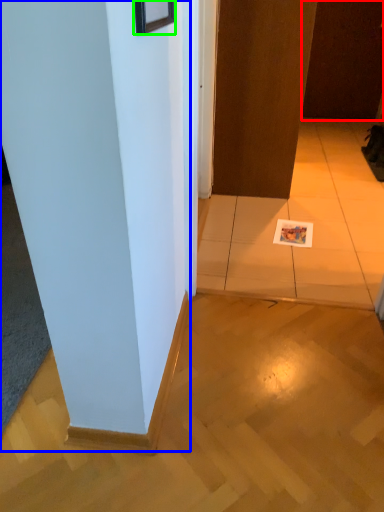
Question: Which is nearer to the door (highlighted by a red box)? pillar (highlighted by a blue box) or picture frame (highlighted by a green box).

Choices:
 (A) pillar
 (B) picture frame

Answer: (A)